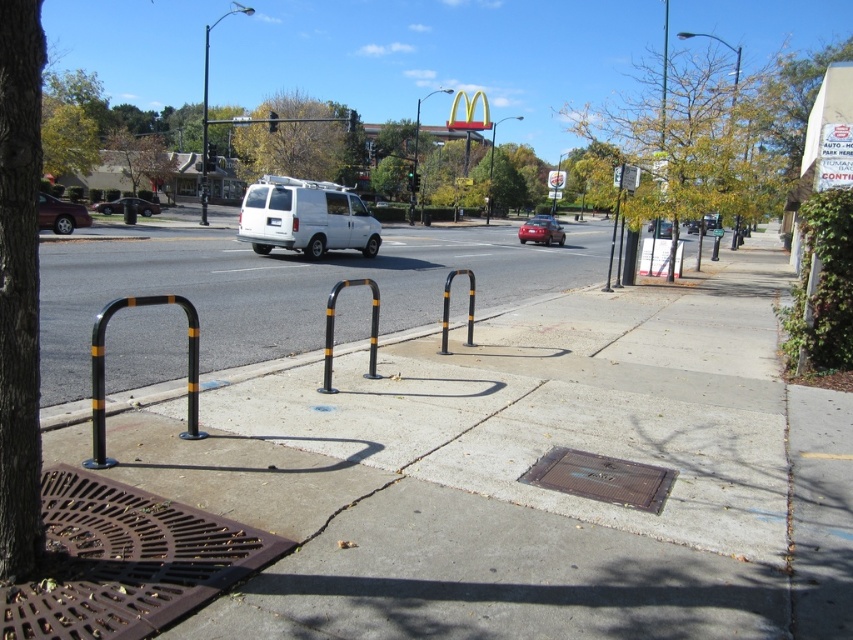
Can you confirm if white matte van at center is positioned below matte red car at center?

Actually, white matte van at center is above matte red car at center.

Which is above, white matte van at center or matte red car at center?

white matte van at center is above.

At what (x,y) coordinates should I click in order to perform the action: click on white matte van at center. Please return your answer as a coordinate pair (x, y). Looking at the image, I should click on (305, 218).

Which is behind, point (206, 177) or point (670, 230)?

The point (206, 177) is more distant.

Looking at this image, which is more to the right, metallic pole at upper center or metallic silver van at center?

Positioned to the right is metallic silver van at center.

Does point (206, 81) come farther from viewer compared to point (654, 228)?

Yes, it is behind point (654, 228).

This screenshot has width=853, height=640. I want to click on metallic pole at upper center, so click(x=204, y=132).

Who is more distant from viewer, (311, 236) or (103, 204)?

The point (103, 204) is behind.

Is white matte van at center bigger than shiny black sedan at center-left?

Yes.

Is point (308, 250) closer to camera compared to point (94, 205)?

Yes, point (308, 250) is closer to viewer.

Find the location of `white matte van at center`. white matte van at center is located at coordinates (305, 218).